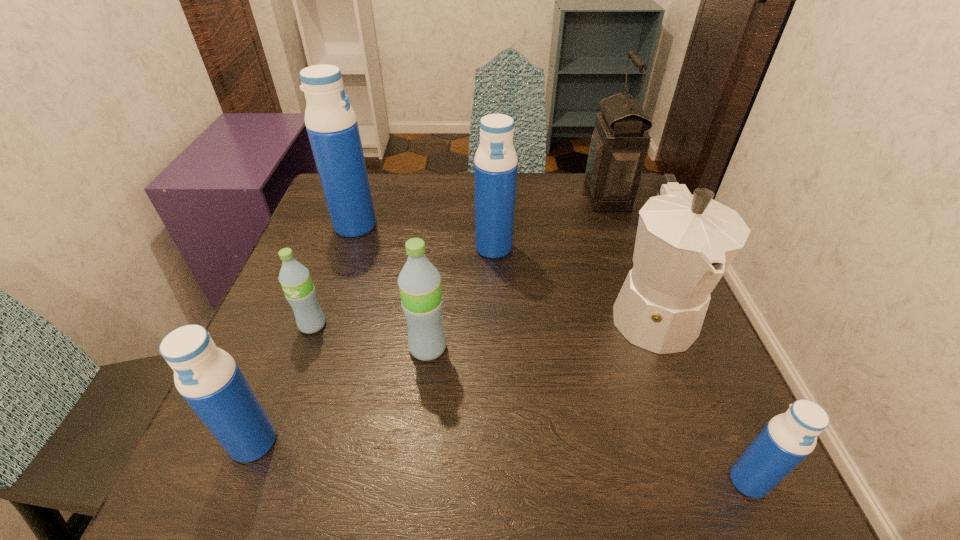
The height and width of the screenshot is (540, 960). I want to click on vacant space that's between the rightmost blue water bottle and the coffeepot, so click(x=700, y=396).

What are the coordinates of `empty location between the third biggest blue water bottle and the third water bottle from right to left` in the screenshot? It's located at (341, 395).

At what (x,y) coordinates should I click in order to perform the action: click on free space between the fifth object from right to left and the coffeepot. Please return your answer as a coordinate pair (x, y). The height and width of the screenshot is (540, 960). Looking at the image, I should click on (540, 329).

Image resolution: width=960 pixels, height=540 pixels. I want to click on empty space between the rightmost water bottle and the second smallest blue water bottle, so 501,461.

At what (x,y) coordinates should I click in order to perform the action: click on free spot between the gray lantern and the smaller green water bottle. Please return your answer as a coordinate pair (x, y). This screenshot has height=540, width=960. Looking at the image, I should click on (460, 261).

The height and width of the screenshot is (540, 960). In order to click on free space between the second smallest blue water bottle and the third smallest blue water bottle in this screenshot , I will do `click(373, 345)`.

Choose which object is the sixth nearest neighbor to the coffeepot. Please provide its 2D coordinates. Your answer should be formatted as a tuple, i.e. [(x, y)], where the tuple contains the x and y coordinates of a point satisfying the conditions above.

[(299, 290)]

At what (x,y) coordinates should I click in order to perform the action: click on the fifth closest object to the right green water bottle. Please return your answer as a coordinate pair (x, y). Looking at the image, I should click on (684, 244).

Where is `water bottle that is the fourth closest to the fifth object from right to left`? water bottle that is the fourth closest to the fifth object from right to left is located at coordinates (331, 123).

Locate an element on the screen. The width and height of the screenshot is (960, 540). water bottle that is the fourth nearest to the gray coffeepot is located at coordinates (331, 123).